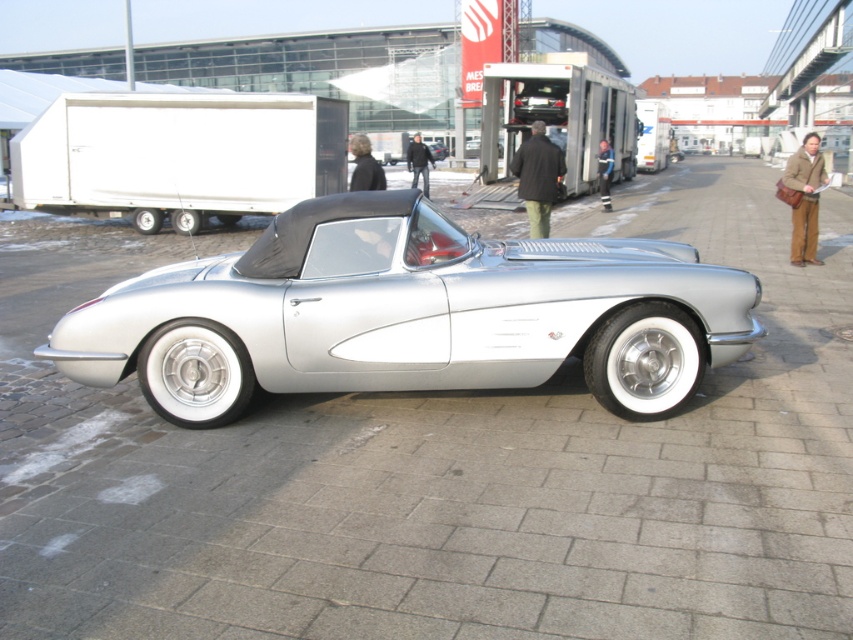
Can you confirm if metallic silver truck at center is positioned to the right of brown leather jacket at right?

No, metallic silver truck at center is not to the right of brown leather jacket at right.

Who is shorter, metallic silver truck at center or brown leather jacket at right?

brown leather jacket at right is shorter.

I want to click on metallic silver truck at center, so click(558, 116).

Is brown leather jacket at right behind dark brown leather jacket at center?

That is True.

Who is positioned more to the left, brown leather jacket at right or dark brown leather jacket at center?

dark brown leather jacket at center

Is point (804, 260) positioned in front of point (351, 148)?

No.

Where is `brown leather jacket at right`? brown leather jacket at right is located at coordinates (804, 198).

Between metallic silver truck at center and green pants at center, which one has less height?

green pants at center

The width and height of the screenshot is (853, 640). Identify the location of metallic silver truck at center. (558, 116).

This screenshot has width=853, height=640. What are the coordinates of `metallic silver truck at center` in the screenshot? It's located at (558, 116).